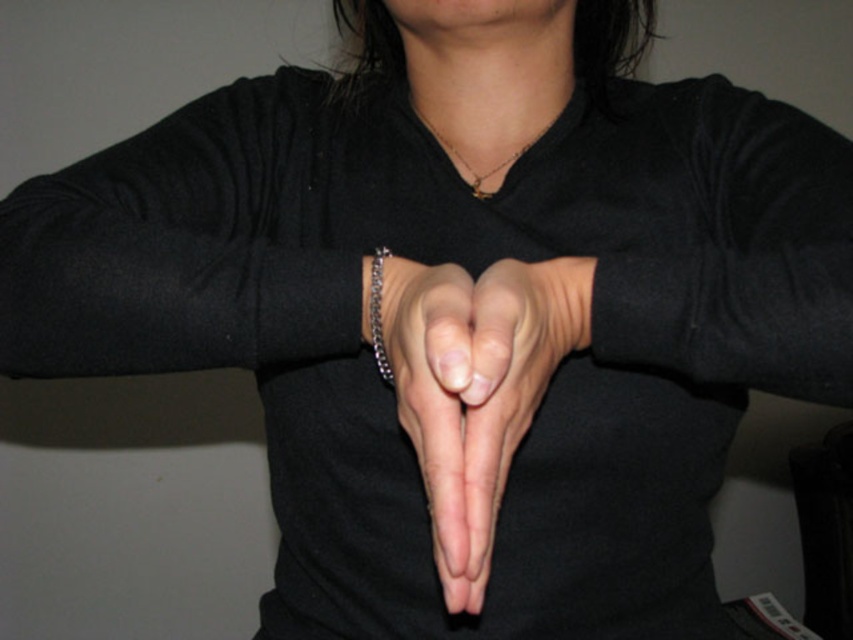
Question: Which of the following is the farthest from the observer?

Choices:
 (A) tap(404, 349)
 (B) tap(567, 292)
 (C) tap(389, 384)

Answer: (C)

Question: Is gold chain at center positioned before silver metallic bracelet at center?

Choices:
 (A) yes
 (B) no

Answer: (B)

Question: Is smooth skin at center to the right of gold chain at center from the viewer's perspective?

Choices:
 (A) yes
 (B) no

Answer: (B)

Question: Which object appears farthest from the camera in this image?

Choices:
 (A) silver metallic bracelet at center
 (B) smooth skin at center
 (C) gold chain at center

Answer: (C)

Question: Which point is closer to the camera?

Choices:
 (A) (515, 154)
 (B) (376, 282)
 (C) (566, 291)
 (D) (424, 474)

Answer: (D)

Question: Does smooth skin hand at center appear on the left side of smooth skin at center?

Choices:
 (A) no
 (B) yes

Answer: (A)